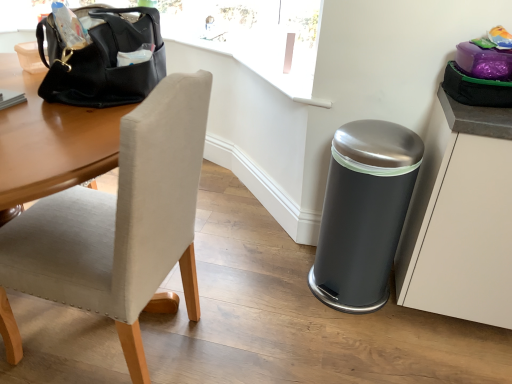
Locate an element on the screen. The height and width of the screenshot is (384, 512). unoccupied area in front of satin silver trash can at lower right is located at coordinates (357, 332).